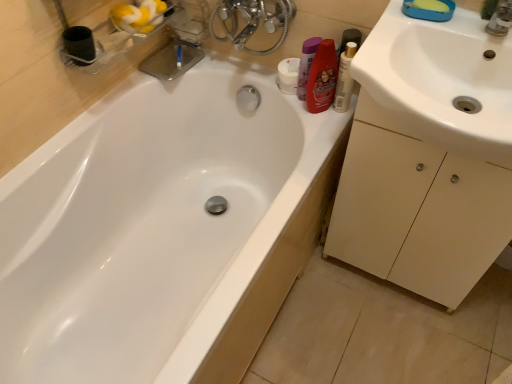
Identify the location of vacant space in front of purple plastic bottle at upper right, marked as the second toiletry in a left-to-right arrangement. This screenshot has height=384, width=512. (319, 130).